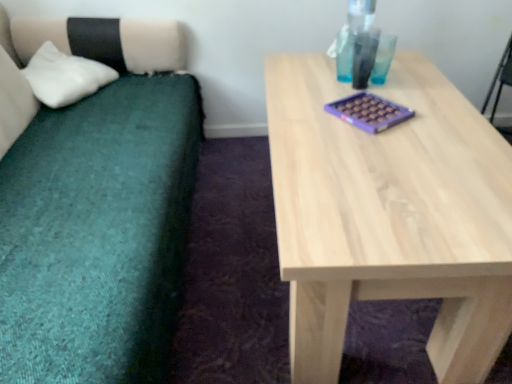
Describe the element at coordinates (64, 76) in the screenshot. I see `white soft pillow at left` at that location.

Measure the distance between natural wood table at center and camera.

The depth of natural wood table at center is 30.41 inches.

Where is `white soft pillow at left`? The height and width of the screenshot is (384, 512). white soft pillow at left is located at coordinates (64, 76).

Which is in front, white soft pillow at left or natural wood table at center?

natural wood table at center is in front.

Can you confirm if white soft pillow at left is positioned to the left of natural wood table at center?

Yes, white soft pillow at left is to the left of natural wood table at center.

From the image's perspective, between white soft pillow at left and natural wood table at center, which one is located above?

white soft pillow at left.

Looking at the image, does white soft pillow at left seem bigger or smaller compared to natural wood table at center?

Clearly, white soft pillow at left is smaller in size than natural wood table at center.

How distant is teal fabric couch at left from white soft pillow at left?

They are 12.81 inches apart.

The height and width of the screenshot is (384, 512). Identify the location of studio couch on the right of white soft pillow at left. (98, 209).

From a real-world perspective, is teal fabric couch at left positioned under white soft pillow at left based on gravity?

Yes, from a real-world perspective, teal fabric couch at left is beneath white soft pillow at left.

Would you consider teal fabric couch at left to be distant from white soft pillow at left?

Actually, teal fabric couch at left and white soft pillow at left are a little close together.

Considering the points (333, 212) and (36, 69), which point is behind, point (333, 212) or point (36, 69)?

The point (36, 69) is behind.

Considering the positions of objects natural wood table at center and white soft pillow at left in the image provided, who is more to the right, natural wood table at center or white soft pillow at left?

natural wood table at center.

Relative to white soft pillow at left, is natural wood table at center in front or behind?

Visually, natural wood table at center is located in front of white soft pillow at left.

Is natural wood table at center taller than white soft pillow at left?

No.

From the image's perspective, which one is positioned higher, white soft pillow at left or teal fabric couch at left?

white soft pillow at left appears higher in the image.

From a real-world perspective, is white soft pillow at left beneath teal fabric couch at left?

No.

How many degrees apart are the facing directions of white soft pillow at left and teal fabric couch at left?

white soft pillow at left and teal fabric couch at left are facing 0.000341 degrees away from each other.

Are white soft pillow at left and teal fabric couch at left making contact?

They are not placed beside each other.

From a real-world perspective, between natural wood table at center and teal fabric couch at left, who is vertically lower?

In real-world perspective, natural wood table at center is lower.

Considering the sizes of natural wood table at center and teal fabric couch at left in the image, is natural wood table at center wider or thinner than teal fabric couch at left?

natural wood table at center is wider than teal fabric couch at left.

Is natural wood table at center located outside teal fabric couch at left?

Yes, natural wood table at center is not within teal fabric couch at left.

Considering the points (438, 273) and (71, 259), which point is in front, point (438, 273) or point (71, 259)?

Point (438, 273)

Consider the image. Considering the sizes of teal fabric couch at left and natural wood table at center in the image, is teal fabric couch at left taller or shorter than natural wood table at center?

In the image, teal fabric couch at left appears to be taller than natural wood table at center.

Which object is positioned more to the right, teal fabric couch at left or natural wood table at center?

natural wood table at center.

Considering the positions of objects teal fabric couch at left and natural wood table at center in the image provided, who is in front, teal fabric couch at left or natural wood table at center?

teal fabric couch at left is in front.

Is natural wood table at center located within teal fabric couch at left?

No, teal fabric couch at left does not contain natural wood table at center.

I want to click on table below the white soft pillow at left (from the image's perspective), so click(x=389, y=214).

Locate an element on the screen. The image size is (512, 384). pillow located above the teal fabric couch at left (from the image's perspective) is located at coordinates (64, 76).

Estimate the real-world distances between objects in this image. Which object is further from natural wood table at center, teal fabric couch at left or white soft pillow at left?

white soft pillow at left is further to natural wood table at center.

Consider the image. Based on their spatial positions, is white soft pillow at left or natural wood table at center further from teal fabric couch at left?

natural wood table at center lies further to teal fabric couch at left than the other object.

Looking at this image, from the image, which object appears to be farther from teal fabric couch at left, natural wood table at center or white soft pillow at left?

natural wood table at center.

Considering their positions, is teal fabric couch at left positioned closer to white soft pillow at left than natural wood table at center?

teal fabric couch at left.

Looking at the image, which one is located closer to white soft pillow at left, natural wood table at center or teal fabric couch at left?

The object closer to white soft pillow at left is teal fabric couch at left.

From the image, which object appears to be nearer to natural wood table at center, white soft pillow at left or teal fabric couch at left?

The object closer to natural wood table at center is teal fabric couch at left.

This screenshot has width=512, height=384. I want to click on table between teal fabric couch at left and white soft pillow at left along the z-axis, so click(x=389, y=214).